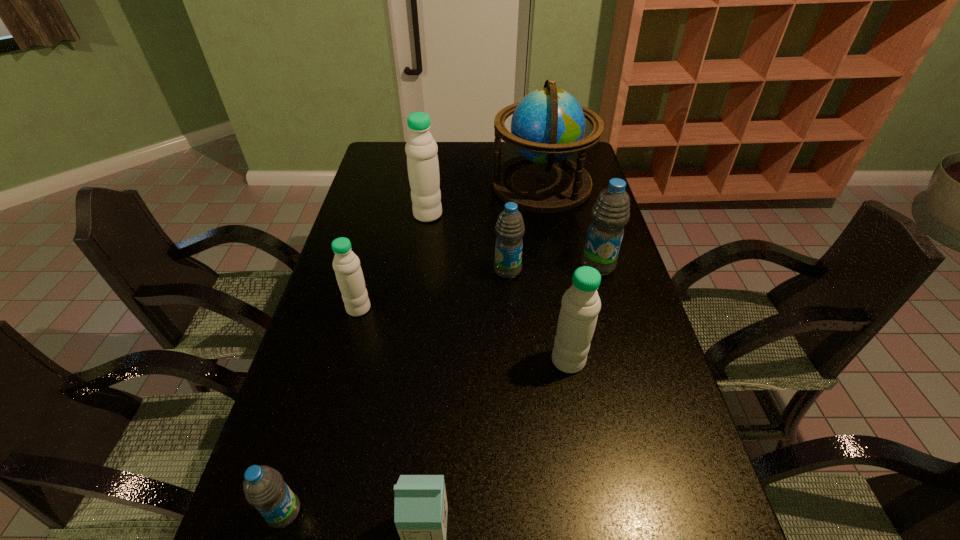
What are the coordinates of `the smallest blue water bottle` in the screenshot? It's located at (264, 488).

Find the location of `the sixth farthest water bottle`. the sixth farthest water bottle is located at coordinates (264, 488).

In order to click on free space located 0.160m on the front of the globe in this screenshot , I will do (x=552, y=242).

This screenshot has width=960, height=540. I want to click on vacant space located 0.070m on the back of the second white water bottle from left to right, so click(x=431, y=195).

Find the location of a particular element. This screenshot has height=540, width=960. free location located on the front of the biggest blue water bottle is located at coordinates (623, 356).

Locate an element on the screen. The image size is (960, 540). vacant area located 0.310m on the front of the second white water bottle from right to left is located at coordinates (594, 512).

You are a GUI agent. You are given a task and a screenshot of the screen. Output one action in this format:
    pyautogui.click(x=<x>, y=<y>)
    Task: Click on the free space located on the left of the second smallest blue water bottle
    Image resolution: width=960 pixels, height=540 pixels.
    Given the screenshot: What is the action you would take?
    pyautogui.click(x=374, y=271)

Locate an element on the screen. This screenshot has width=960, height=540. vacant space situated 0.170m on the front of the leftmost white water bottle is located at coordinates (342, 370).

I want to click on vacant space located 0.400m on the right of the leftmost blue water bottle, so click(x=509, y=512).

Locate an element on the screen. The height and width of the screenshot is (540, 960). object present at the far edge is located at coordinates (548, 125).